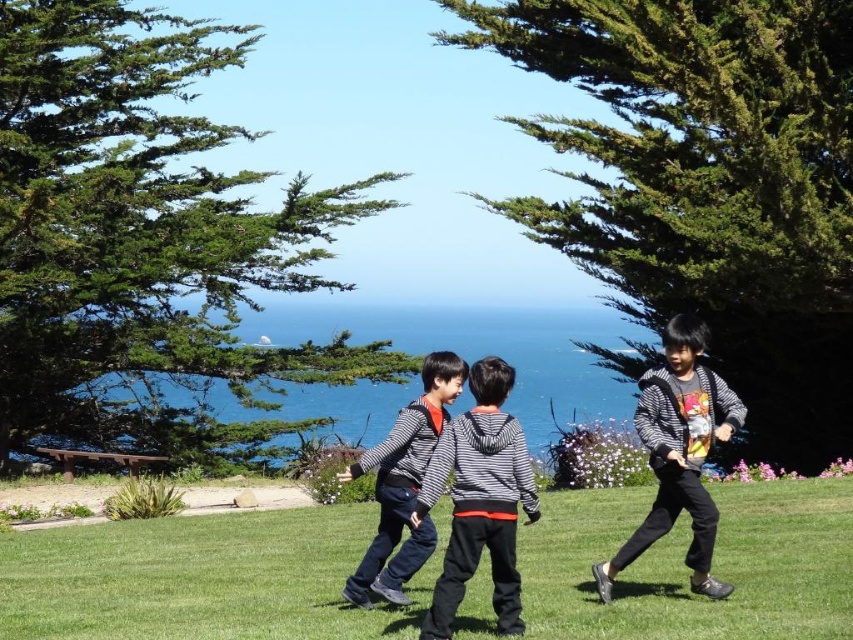
What do you see at coordinates (679, 452) in the screenshot?
I see `striped sweater at right` at bounding box center [679, 452].

Can you confirm if striped sweater at right is shorter than striped fabric jacket at center?

No.

Is point (654, 417) less distant than point (372, 589)?

Yes, point (654, 417) is in front of point (372, 589).

Image resolution: width=853 pixels, height=640 pixels. Find the location of `striped sweater at right`. striped sweater at right is located at coordinates (679, 452).

At what (x,y) coordinates should I click in order to perform the action: click on green grass at center. Please return your answer as a coordinate pair (x, y). Looking at the image, I should click on (201, 579).

Does green textured pine at upper left appear on the left side of green textured pine at center?

Indeed, green textured pine at upper left is positioned on the left side of green textured pine at center.

Is green textured pine at upper left wider than green textured pine at center?

Indeed, green textured pine at upper left has a greater width compared to green textured pine at center.

At what (x,y) coordinates should I click in order to perform the action: click on green textured pine at upper left. Please return your answer as a coordinate pair (x, y). Looking at the image, I should click on (144, 243).